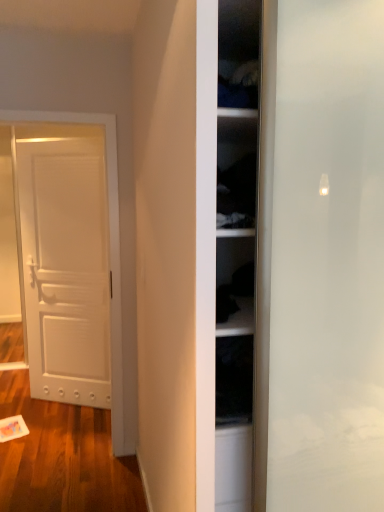
Where is `white matte door at left`? white matte door at left is located at coordinates (67, 260).

What do you see at coordinates (67, 260) in the screenshot? I see `white matte door at left` at bounding box center [67, 260].

What is the approximate height of white matte door at left?

white matte door at left is 2.04 meters in height.

In order to click on white matte door at left in this screenshot , I will do `click(67, 260)`.